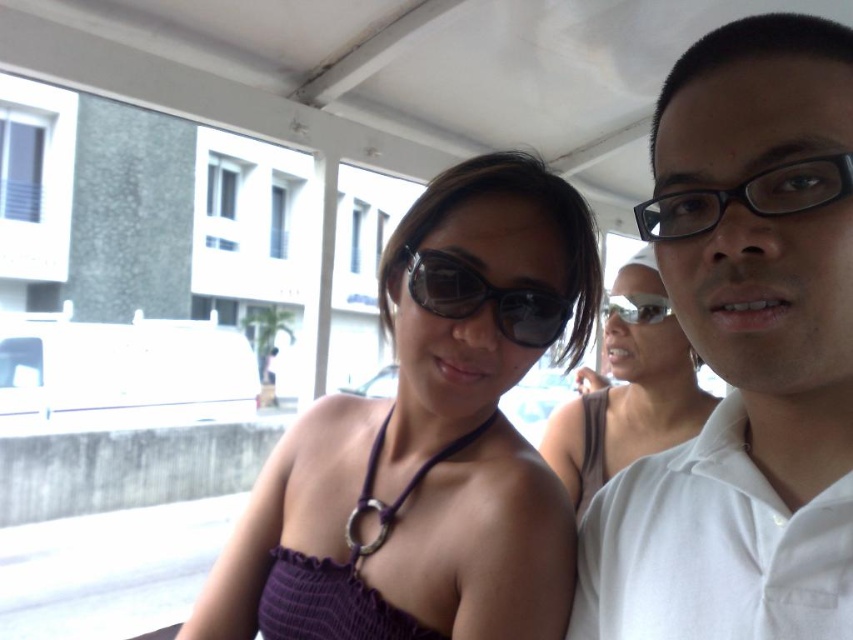
Does black plastic glasses at right appear over transparent plastic goggles at upper center?

Indeed, black plastic glasses at right is positioned over transparent plastic goggles at upper center.

Can you confirm if black plastic glasses at right is positioned below transparent plastic goggles at upper center?

Actually, black plastic glasses at right is above transparent plastic goggles at upper center.

Between point (792, 192) and point (602, 312), which one is positioned behind?

The point (602, 312) is behind.

Where is `black plastic glasses at right`? black plastic glasses at right is located at coordinates (747, 196).

Can you confirm if sunglasses at center is shorter than transparent plastic goggles at upper center?

In fact, sunglasses at center may be taller than transparent plastic goggles at upper center.

Between sunglasses at center and transparent plastic goggles at upper center, which one has less height?

Standing shorter between the two is transparent plastic goggles at upper center.

Describe the element at coordinates (485, 298) in the screenshot. The height and width of the screenshot is (640, 853). I see `sunglasses at center` at that location.

The width and height of the screenshot is (853, 640). What are the coordinates of `sunglasses at center` in the screenshot? It's located at (485, 298).

Can you confirm if white cotton shirt at center is positioned below black plastic glasses at right?

Correct, white cotton shirt at center is located below black plastic glasses at right.

Between point (722, 452) and point (744, 202), which one is positioned behind?

The point (722, 452) is behind.

The width and height of the screenshot is (853, 640). Describe the element at coordinates (744, 353) in the screenshot. I see `white cotton shirt at center` at that location.

At what (x,y) coordinates should I click in order to perform the action: click on white cotton shirt at center. Please return your answer as a coordinate pair (x, y). This screenshot has height=640, width=853. Looking at the image, I should click on (744, 353).